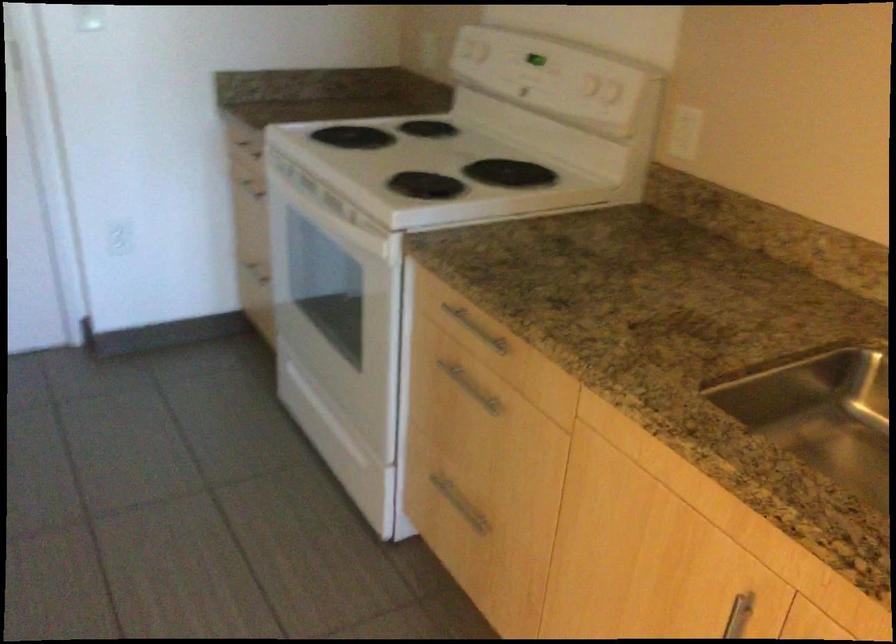
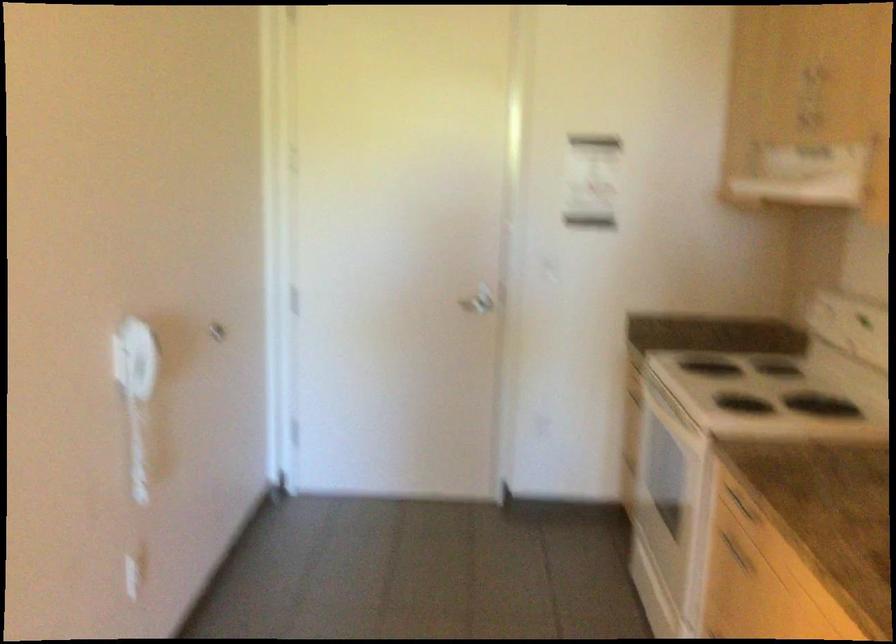
Question: The images are taken continuously from a first-person perspective. In which direction is your viewpoint rotating?

Choices:
 (A) Left
 (B) Right
 (C) Up
 (D) Down

Answer: (A)